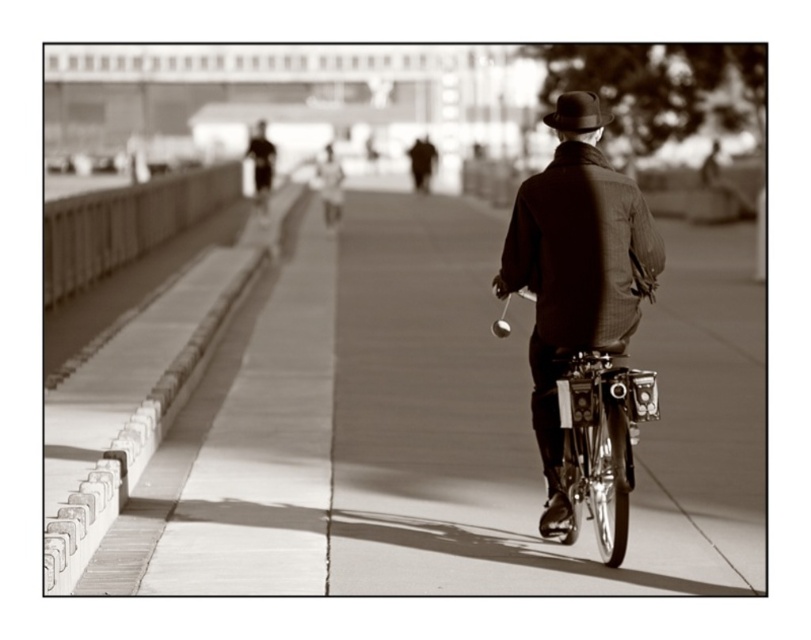
You are a photographer who just took this vintage photo. You want to know if the smooth concrete pavement at center is visible below the dark brown felt hat at upper center. Can you confirm?

Yes, the smooth concrete pavement at center is located below the dark brown felt hat at upper center, so it is visible in that position.

The scene shows a vintage photograph of a cyclist on a walkway or bridge. There is a point marked at coordinates (440, 428). What type of surface is located at this point?

The surface at point (440, 428) is smooth concrete pavement at center.

You are a photographer who wants to capture a closeup of the dark brown felt hat at upper center while keeping the matte brown jacket at center in the frame. Can you adjust your camera angle to focus on the hat without moving the jacket out of the shot?

The matte brown jacket at center is below the dark brown felt hat at upper center, so adjusting the camera angle downward will allow focusing on the hat while keeping the jacket in the frame.